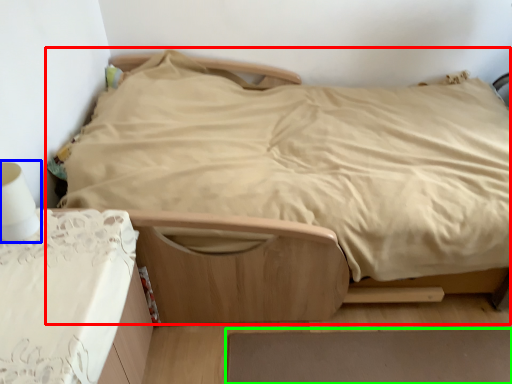
Question: Considering the real-world distances, which object is farthest from bed (highlighted by a red box)? table lamp (highlighted by a blue box) or plain (highlighted by a green box)?

Choices:
 (A) table lamp
 (B) plain

Answer: (A)